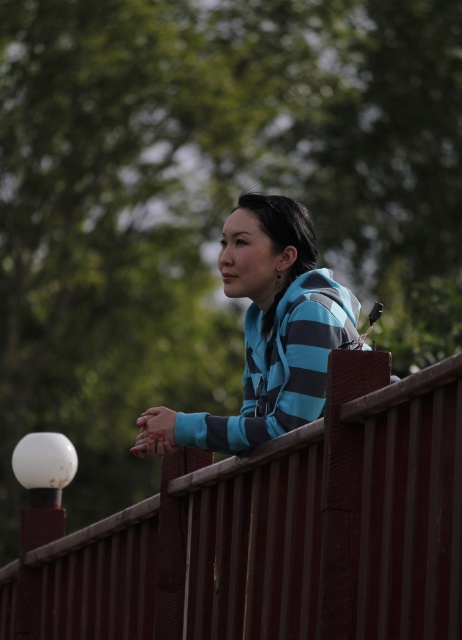
Can you confirm if rustic wood fence at center is positioned above blue striped hoodie at center?

Actually, rustic wood fence at center is below blue striped hoodie at center.

Between rustic wood fence at center and blue striped hoodie at center, which one has more height?

Standing taller between the two is rustic wood fence at center.

Who is more distant from viewer, (71, 548) or (332, 300)?

Positioned behind is point (71, 548).

The width and height of the screenshot is (462, 640). What are the coordinates of `rustic wood fence at center` in the screenshot? It's located at (279, 532).